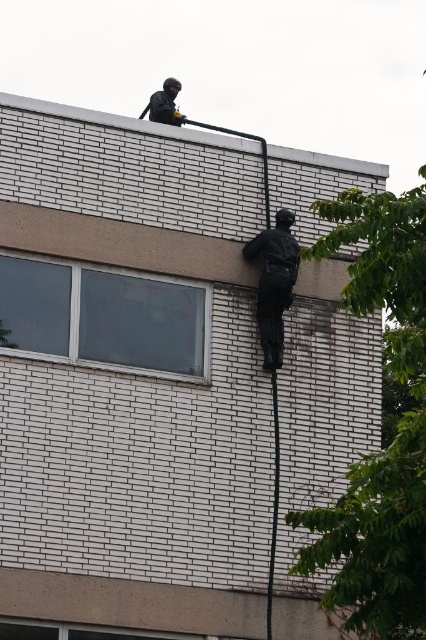
In order to click on clear glass window at lower left in this screenshot , I will do `click(104, 316)`.

Is clear glass window at lower left bigger than matte black figure at center?

Incorrect, clear glass window at lower left is not larger than matte black figure at center.

Describe the element at coordinates (104, 316) in the screenshot. I see `clear glass window at lower left` at that location.

The image size is (426, 640). Identify the location of clear glass window at lower left. (104, 316).

Between matte black figure at center and black matte helmet at upper center, which one has less height?

matte black figure at center is shorter.

Between point (275, 228) and point (164, 120), which one is positioned behind?

Point (164, 120)

Where is `matte black figure at center`? matte black figure at center is located at coordinates (273, 282).

Looking at this image, who is more distant from viewer, (189, 369) or (150, 108)?

The point (150, 108) is more distant.

Is the position of clear glass window at lower left less distant than that of black matte helmet at upper center?

Yes, clear glass window at lower left is closer to the viewer.

Who is more distant from viewer, (88, 292) or (158, 92)?

The point (158, 92) is more distant.

Where is `clear glass window at lower left`? The image size is (426, 640). clear glass window at lower left is located at coordinates (104, 316).